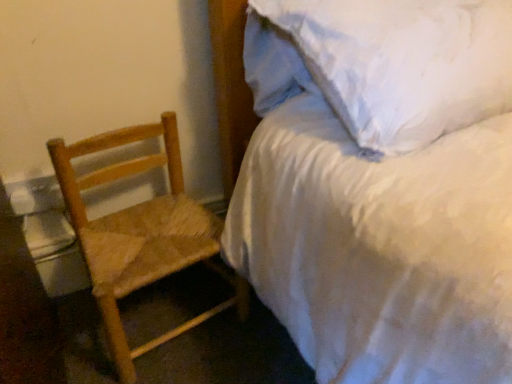
Question: Is the position of natural wood woven chair at left more distant than that of white satin bed at upper right?

Choices:
 (A) yes
 (B) no

Answer: (A)

Question: From a real-world perspective, does natural wood woven chair at left sit lower than white satin bed at upper right?

Choices:
 (A) no
 (B) yes

Answer: (B)

Question: From a real-world perspective, is natural wood woven chair at left physically above white satin bed at upper right?

Choices:
 (A) no
 (B) yes

Answer: (A)

Question: From the image's perspective, would you say natural wood woven chair at left is positioned over white satin bed at upper right?

Choices:
 (A) no
 (B) yes

Answer: (A)

Question: Considering the relative sizes of natural wood woven chair at left and white satin bed at upper right in the image provided, is natural wood woven chair at left wider than white satin bed at upper right?

Choices:
 (A) no
 (B) yes

Answer: (A)

Question: Is natural wood woven chair at left at the right side of white satin bed at upper right?

Choices:
 (A) no
 (B) yes

Answer: (A)

Question: Can you confirm if white satin bed at upper right is taller than natural wood woven chair at left?

Choices:
 (A) no
 (B) yes

Answer: (B)

Question: Would you say natural wood woven chair at left is part of white satin bed at upper right's contents?

Choices:
 (A) yes
 (B) no

Answer: (B)

Question: Can we say white satin bed at upper right lies outside natural wood woven chair at left?

Choices:
 (A) yes
 (B) no

Answer: (A)

Question: Can you confirm if white satin bed at upper right is thinner than natural wood woven chair at left?

Choices:
 (A) no
 (B) yes

Answer: (A)

Question: Does white satin bed at upper right come in front of natural wood woven chair at left?

Choices:
 (A) yes
 (B) no

Answer: (A)

Question: From the image's perspective, is white satin bed at upper right below natural wood woven chair at left?

Choices:
 (A) no
 (B) yes

Answer: (A)

Question: Looking at their shapes, would you say white satin bed at upper right is wider or thinner than natural wood woven chair at left?

Choices:
 (A) wide
 (B) thin

Answer: (A)